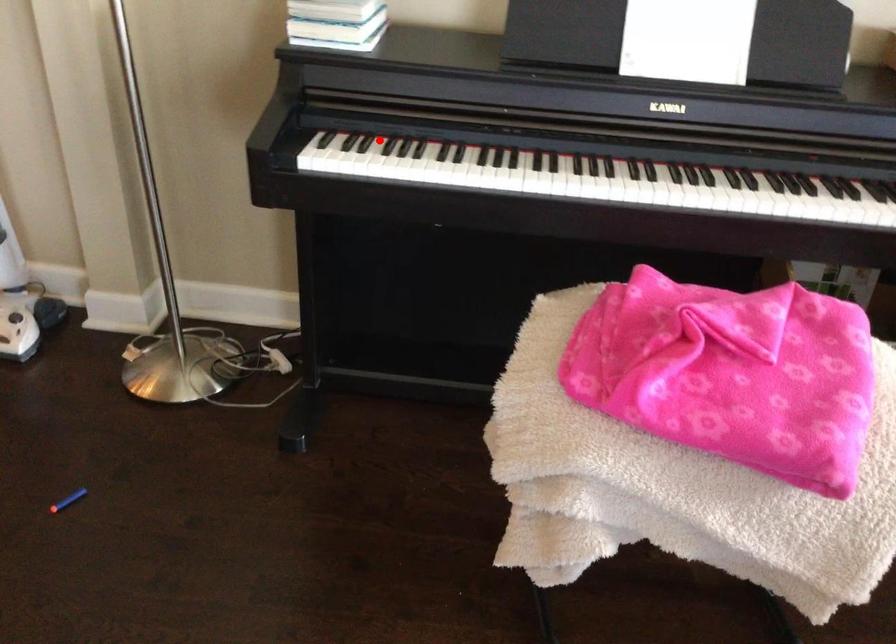
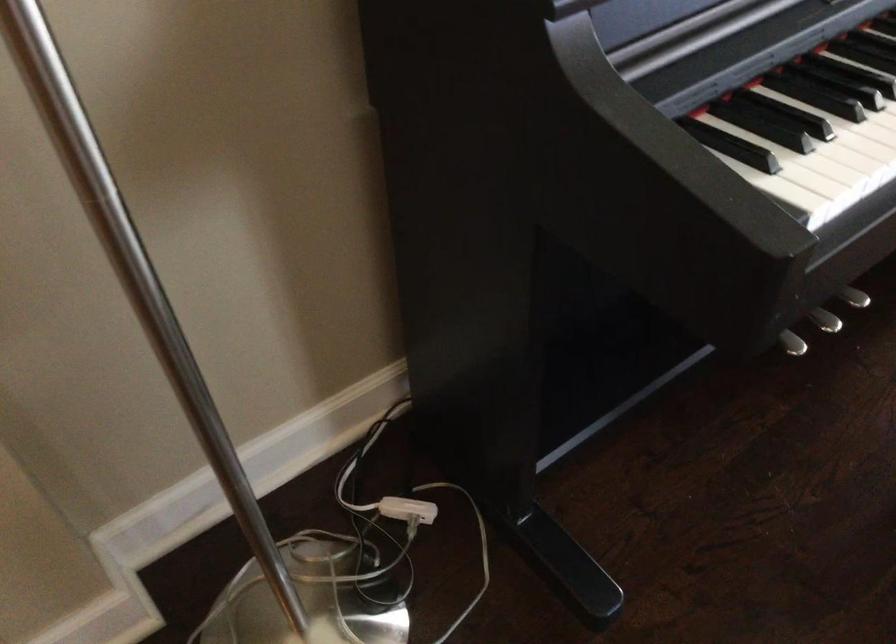
Question: I am providing you with two images of the same scene from different viewpoints. Image1 has a red point marked. In image2, the corresponding 3D location appears at what relative position? Reply with the corresponding letter.

Choices:
 (A) Closer
 (B) Farther

Answer: (A)